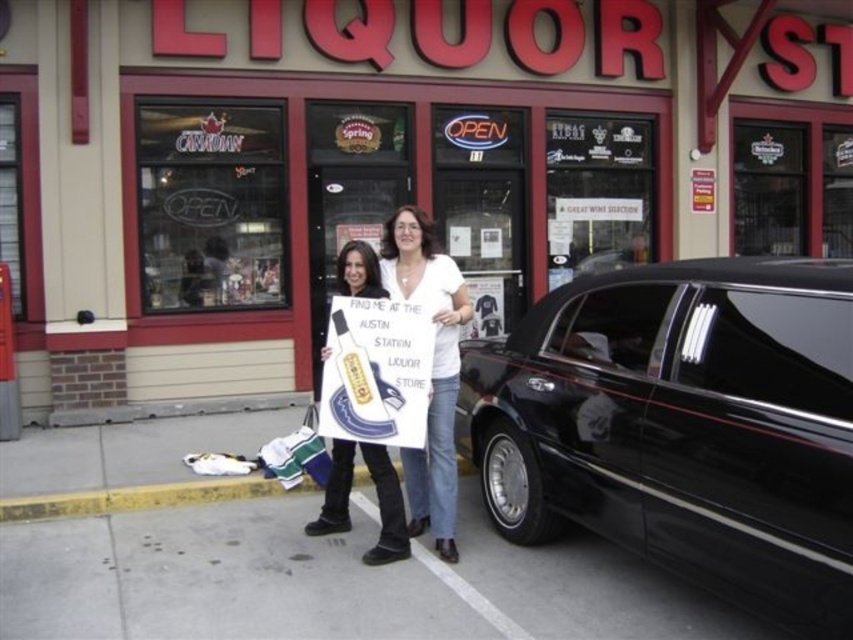
Question: Estimate the real-world distances between objects in this image. Which object is farther from the matte black car at right?

Choices:
 (A) white cotton shirt at center
 (B) denim jeans at center
 (C) black glossy limousine at right

Answer: (B)

Question: Estimate the real-world distances between objects in this image. Which object is closer to the denim jeans at center?

Choices:
 (A) white cotton shirt at center
 (B) matte black car at right
 (C) black glossy limousine at right

Answer: (A)

Question: Is matte black car at right to the left of denim jeans at center from the viewer's perspective?

Choices:
 (A) yes
 (B) no

Answer: (B)

Question: Does matte black car at right appear on the left side of denim jeans at center?

Choices:
 (A) no
 (B) yes

Answer: (A)

Question: Which is nearer to the black glossy limousine at right?

Choices:
 (A) matte black car at right
 (B) white cotton shirt at center

Answer: (B)

Question: Where is white cotton shirt at center located in relation to denim jeans at center in the image?

Choices:
 (A) above
 (B) below

Answer: (A)